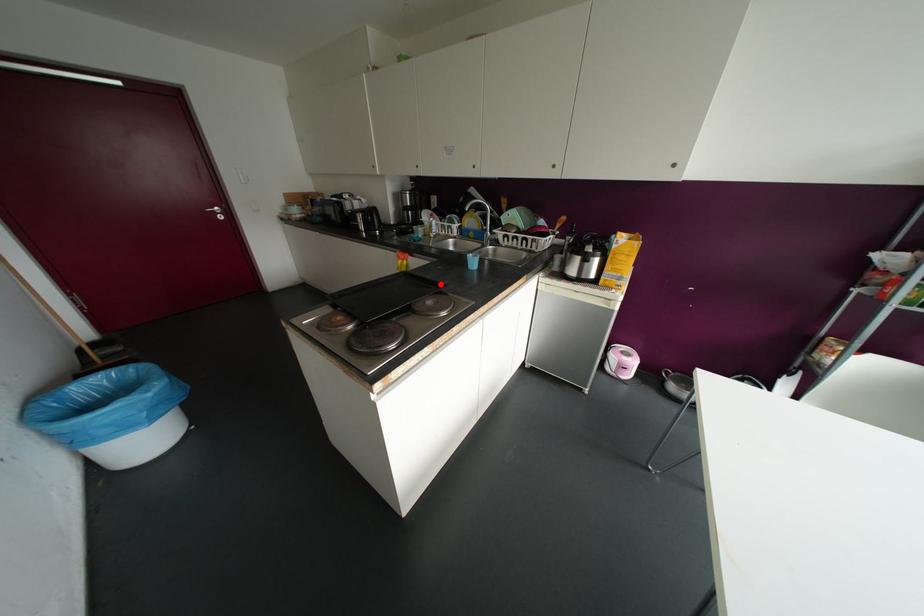
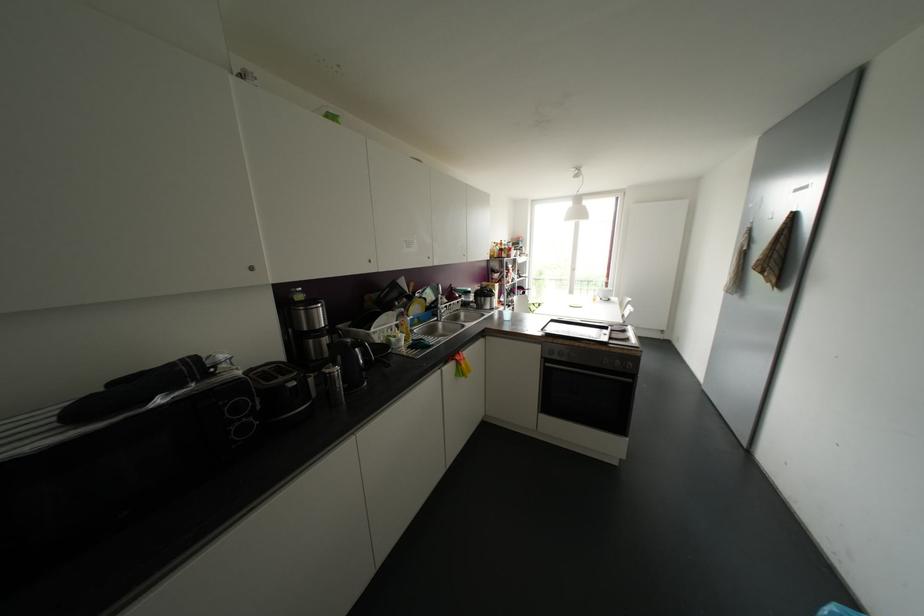
Question: I am providing you with two images of the same scene from different viewpoints. Image1 has a red point marked. In image2, the corresponding 3D location appears at what relative position? Reply with the corresponding letter.

Choices:
 (A) Closer
 (B) Farther

Answer: (A)